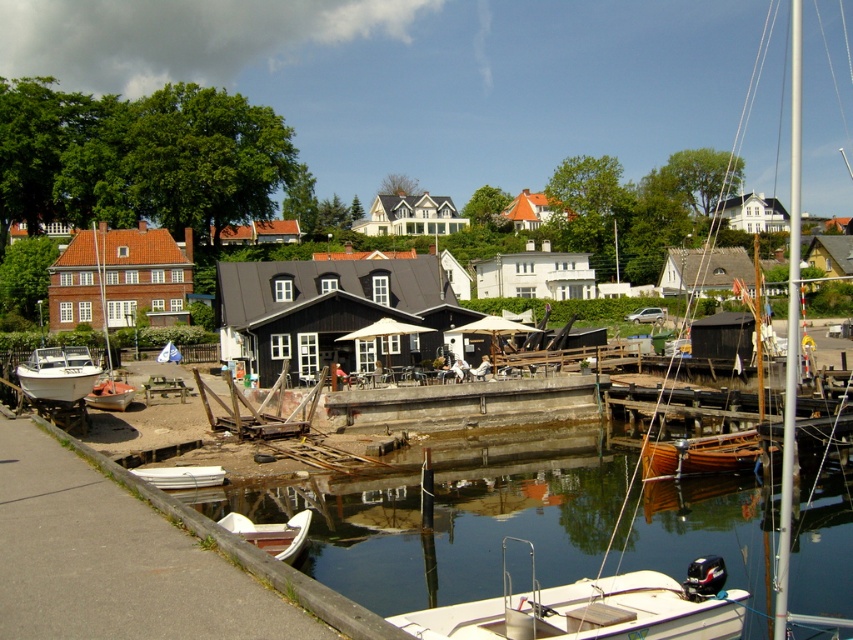
You are planning to transport a large sculpture that requires a boat with a width of at least 3 meters. Based on the scene, which boat between the wooden boat at lower right and the white matte boat at left would be more suitable for your sculpture?

The white matte boat at left is more suitable because it is wider than the wooden boat at lower right, meeting the sculpture transport requirement.

You are a visitor standing at the waterfront and want to reach the white plastic boat at lower center. Which direction should you move relative to the smooth concrete dock at lower center?

To reach the white plastic boat at lower center from the smooth concrete dock at lower center, you should move upward since the dock is located below the boat.